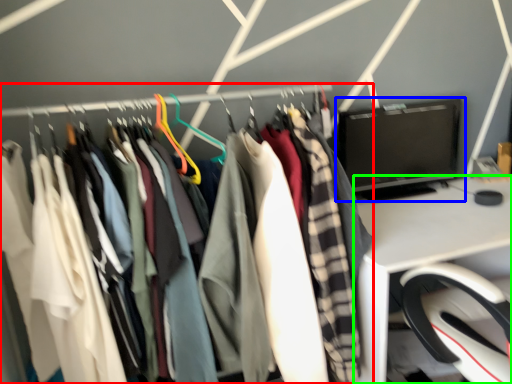
Question: Which is nearer to the closet (highlighted by a red box)? computer monitor (highlighted by a blue box) or desk (highlighted by a green box).

Choices:
 (A) computer monitor
 (B) desk

Answer: (B)